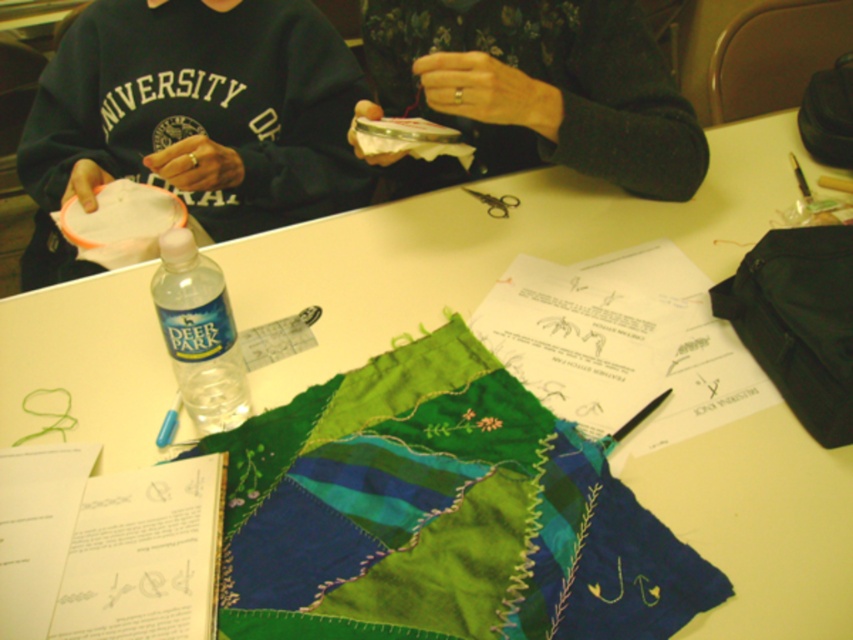
From the picture: Does textured green fabric at center lie in front of matte black sweatshirt at upper left?

Yes.

Image resolution: width=853 pixels, height=640 pixels. Describe the element at coordinates (439, 515) in the screenshot. I see `textured green fabric at center` at that location.

Who is more distant from viewer, (344, 604) or (57, 160)?

Point (57, 160)

Where is `textured green fabric at center`? The width and height of the screenshot is (853, 640). textured green fabric at center is located at coordinates (439, 515).

Who is higher up, matte black sweatshirt at upper left or clear plastic bottle at center?

matte black sweatshirt at upper left

Who is shorter, matte black sweatshirt at upper left or clear plastic bottle at center?

clear plastic bottle at center

Locate an element on the screen. This screenshot has width=853, height=640. matte black sweatshirt at upper left is located at coordinates (194, 118).

Can you confirm if textured green fabric at center is thinner than matte black fabric at upper center?

Incorrect, textured green fabric at center's width is not less than matte black fabric at upper center's.

Can you confirm if textured green fabric at center is positioned below matte black fabric at upper center?

Correct, textured green fabric at center is located below matte black fabric at upper center.

Is point (666, 560) farther from camera compared to point (641, 128)?

No, it is not.

Find the location of a particular element. The width and height of the screenshot is (853, 640). textured green fabric at center is located at coordinates (439, 515).